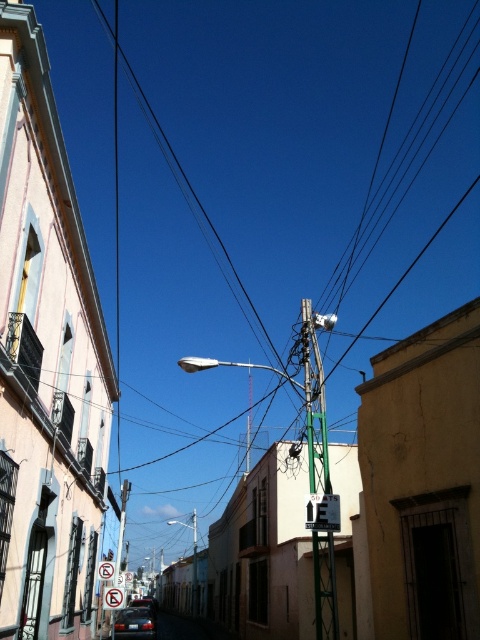
Question: Can you confirm if white plastic street sign at center is positioned to the right of metallic rectangular sign at center?

Choices:
 (A) yes
 (B) no

Answer: (A)

Question: Which object is positioned closest to the shiny red car at center?

Choices:
 (A) shiny black car at lower center
 (B) metallic rectangular sign at center
 (C) white plastic street sign at center

Answer: (A)

Question: Does white plastic street sign at center have a lesser width compared to shiny red car at center?

Choices:
 (A) no
 (B) yes

Answer: (B)

Question: Which point is closer to the camera?

Choices:
 (A) shiny red car at center
 (B) metallic rectangular sign at center
 (C) white plastic street sign at center
 (D) shiny black car at lower center

Answer: (C)

Question: From the image, what is the correct spatial relationship of white plastic street sign at center in relation to metallic rectangular sign at center?

Choices:
 (A) below
 (B) above

Answer: (B)

Question: Which point is closer to the camera?

Choices:
 (A) (107, 605)
 (B) (323, 516)
 (C) (144, 604)
 (D) (117, 632)

Answer: (B)